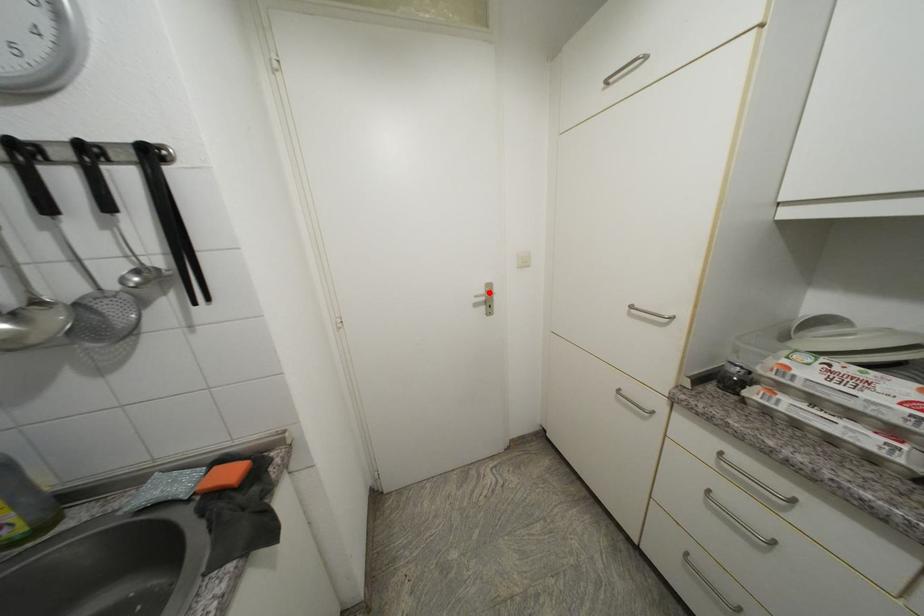
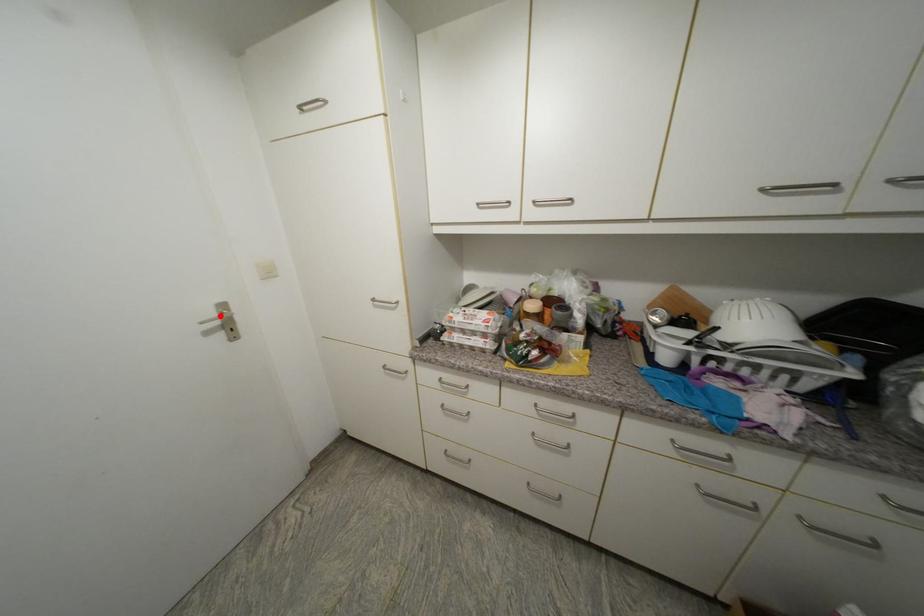
I am providing you with two images of the same scene from different viewpoints. A red point is marked on the first image and another point is marked on the second image. Is the marked point in image1 the same physical position as the marked point in image2?

Yes